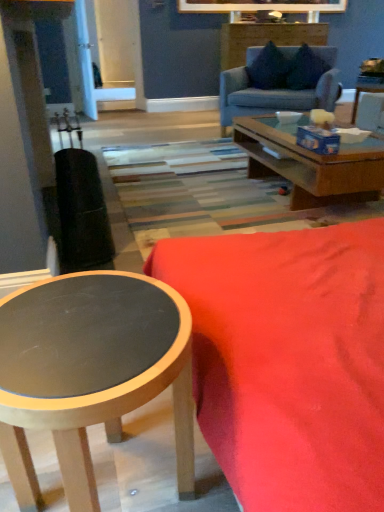
Question: Considering the relative sizes of wooden side table at upper right and light blue fabric couch at upper center, arranged as the first studio couch when viewed from the back, in the image provided, is wooden side table at upper right wider than light blue fabric couch at upper center, arranged as the first studio couch when viewed from the back,?

Choices:
 (A) no
 (B) yes

Answer: (A)

Question: Could light blue fabric couch at upper center, arranged as the first studio couch when viewed from the back, be considered to be inside wooden side table at upper right?

Choices:
 (A) no
 (B) yes

Answer: (A)

Question: Does wooden side table at upper right appear on the left side of light blue fabric couch at upper center, which is the 2th studio couch from front to back?

Choices:
 (A) yes
 (B) no

Answer: (B)

Question: Is wooden side table at upper right bigger than light blue fabric couch at upper center, arranged as the first studio couch when viewed from the back?

Choices:
 (A) yes
 (B) no

Answer: (B)

Question: From a real-world perspective, is wooden side table at upper right located higher than light blue fabric couch at upper center, arranged as the first studio couch when viewed from the back?

Choices:
 (A) yes
 (B) no

Answer: (B)

Question: Would you say wooden side table at upper right is to the left or to the right of matte black coffee table at lower left in the picture?

Choices:
 (A) left
 (B) right

Answer: (B)

Question: Does point (379, 89) appear closer or farther from the camera than point (155, 303)?

Choices:
 (A) closer
 (B) farther

Answer: (B)

Question: Is wooden side table at upper right bigger or smaller than matte black coffee table at lower left?

Choices:
 (A) big
 (B) small

Answer: (B)

Question: Relative to matte black coffee table at lower left, is wooden side table at upper right in front or behind?

Choices:
 (A) front
 (B) behind

Answer: (B)

Question: Considering the positions of point (365, 81) and point (281, 60), is point (365, 81) closer or farther from the camera than point (281, 60)?

Choices:
 (A) farther
 (B) closer

Answer: (B)

Question: Is wooden side table at upper right inside or outside of velvet dark blue pillow at upper center, arranged as the second pillow when viewed from the right?

Choices:
 (A) outside
 (B) inside

Answer: (A)

Question: Relative to velvet dark blue pillow at upper center, arranged as the second pillow when viewed from the right, is wooden side table at upper right in front or behind?

Choices:
 (A) behind
 (B) front

Answer: (B)

Question: Considering the positions of wooden side table at upper right and velvet dark blue pillow at upper center, the first pillow in the left-to-right sequence, in the image, is wooden side table at upper right taller or shorter than velvet dark blue pillow at upper center, the first pillow in the left-to-right sequence,?

Choices:
 (A) tall
 (B) short

Answer: (B)

Question: Does point (258, 495) appear closer or farther from the camera than point (324, 72)?

Choices:
 (A) farther
 (B) closer

Answer: (B)

Question: From the image's perspective, is velvet red couch at lower right, marked as the 1th studio couch in a bottom-to-top arrangement, positioned above or below suede-like dark blue pillow at upper center, which is the 1th pillow in right-to-left order?

Choices:
 (A) below
 (B) above

Answer: (A)